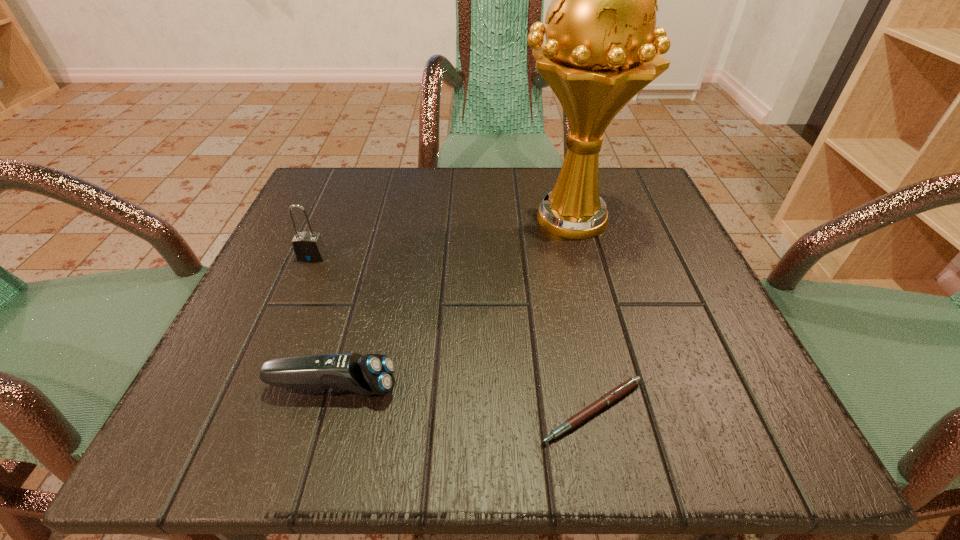
Find the location of a particular element. The width and height of the screenshot is (960, 540). electric shaver that is at the near edge is located at coordinates (372, 374).

The width and height of the screenshot is (960, 540). In order to click on pen present at the near edge in this screenshot , I will do `click(621, 390)`.

The height and width of the screenshot is (540, 960). In order to click on padlock situated at the left edge in this screenshot , I will do `click(308, 246)`.

The image size is (960, 540). I want to click on electric shaver that is at the left edge, so pyautogui.click(x=372, y=374).

The width and height of the screenshot is (960, 540). Identify the location of trophy_cup present at the right edge. (602, 44).

Where is `pen located at the right edge`? The width and height of the screenshot is (960, 540). pen located at the right edge is located at coordinates (621, 390).

Where is `object located in the near left corner section of the desktop`? Image resolution: width=960 pixels, height=540 pixels. object located in the near left corner section of the desktop is located at coordinates (372, 374).

Locate an element on the screen. object situated at the far right corner is located at coordinates (602, 44).

I want to click on object present at the near right corner, so click(621, 390).

Image resolution: width=960 pixels, height=540 pixels. Find the location of `vacant space at the far edge of the desktop`. vacant space at the far edge of the desktop is located at coordinates (408, 187).